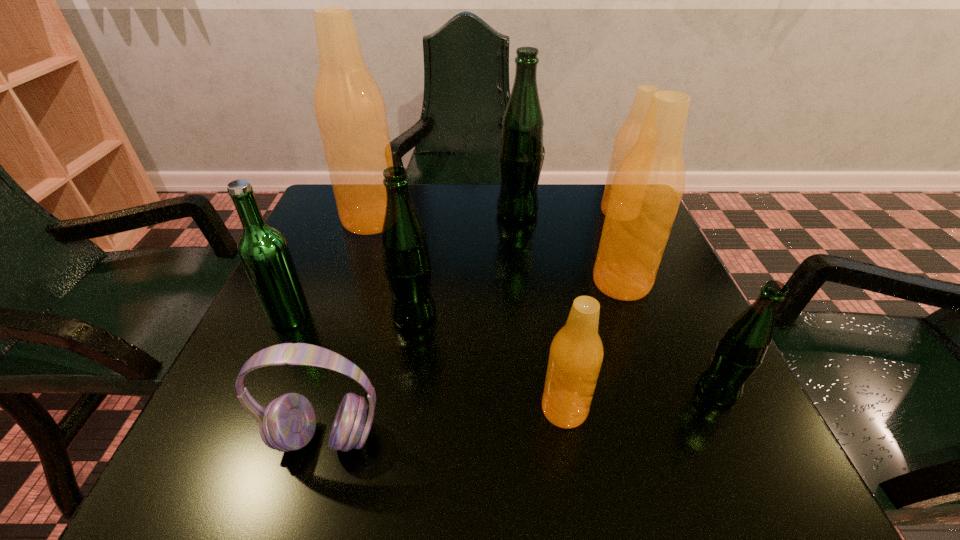
In the image, there is a desktop. Where is `free space at the right edge`? The image size is (960, 540). free space at the right edge is located at coordinates (639, 372).

Identify the location of vacant space at the far left corner of the desktop. (326, 199).

Locate an element on the screen. free space at the far right corner of the desktop is located at coordinates (592, 184).

Locate an element on the screen. Image resolution: width=960 pixels, height=540 pixels. free space at the near right corner is located at coordinates (664, 476).

The width and height of the screenshot is (960, 540). I want to click on free space that is in between the leftmost green beer bottle and the shortest object, so click(x=307, y=377).

You are a GUI agent. You are given a task and a screenshot of the screen. Output one action in this format:
    pyautogui.click(x=<x>, y=<y>)
    Task: Click on the free space between the shortest object and the leftmost green beer bottle
    
    Given the screenshot: What is the action you would take?
    pyautogui.click(x=307, y=377)

At what (x,y) coordinates should I click in order to perform the action: click on unoccupied position between the third tan beer bottle from right to left and the nearest green beer bottle. Please return your answer as a coordinate pair (x, y). The height and width of the screenshot is (540, 960). Looking at the image, I should click on (640, 400).

Identify the location of free space between the tallest beer bottle and the farthest green beer bottle. (444, 216).

Image resolution: width=960 pixels, height=540 pixels. I want to click on unoccupied area between the second biggest tan beer bottle and the third green beer bottle from right to left, so click(517, 299).

This screenshot has width=960, height=540. Find the location of `free spot between the smallest green beer bottle and the second smallest tan beer bottle`. free spot between the smallest green beer bottle and the second smallest tan beer bottle is located at coordinates (668, 301).